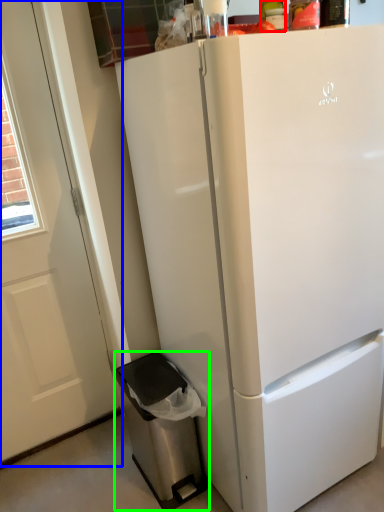
Question: Which object is positioned closest to bottle (highlighted by a red box)? Select from screen door (highlighted by a blue box) and dish washer (highlighted by a green box).

Choices:
 (A) screen door
 (B) dish washer

Answer: (A)